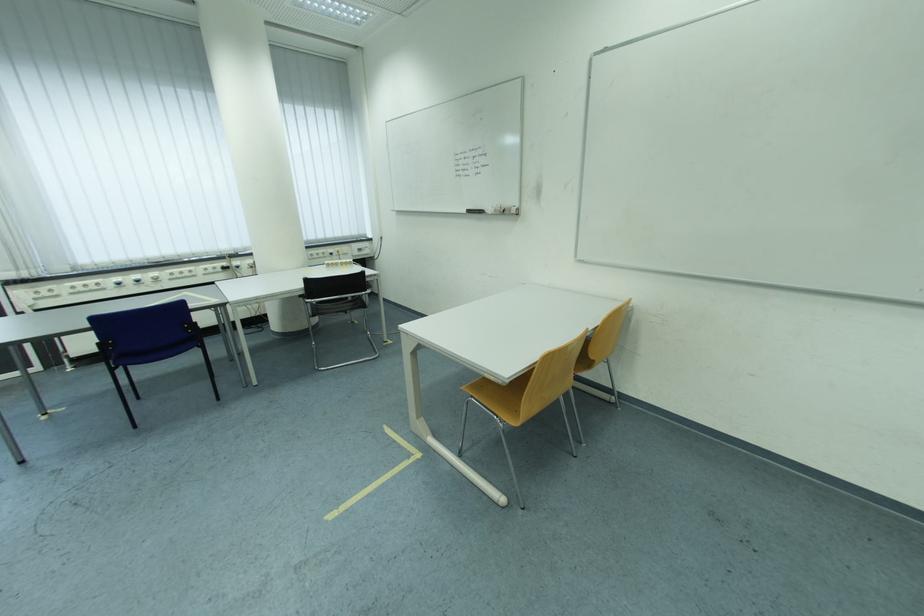
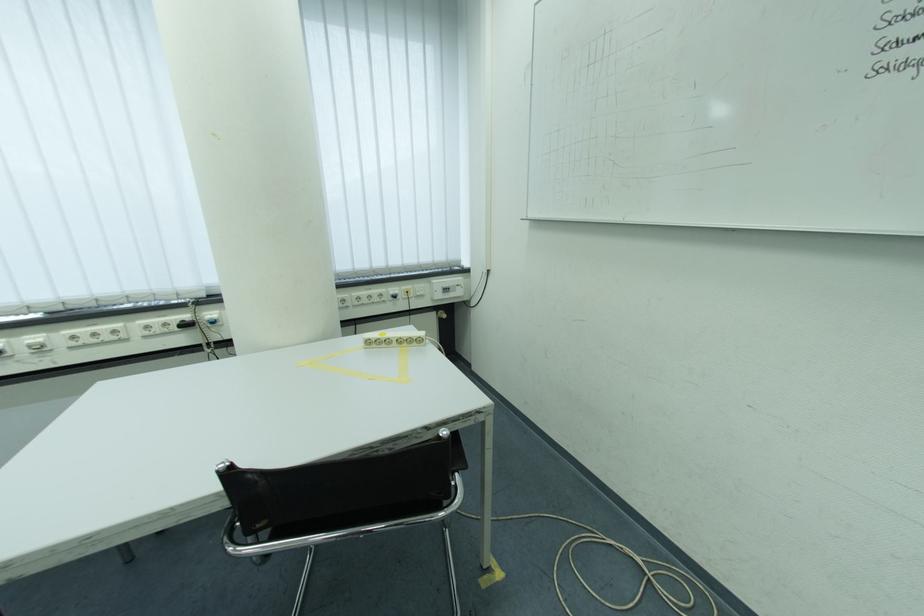
Find the pixel in the second image that matches (x=321, y=257) in the first image.

(368, 301)